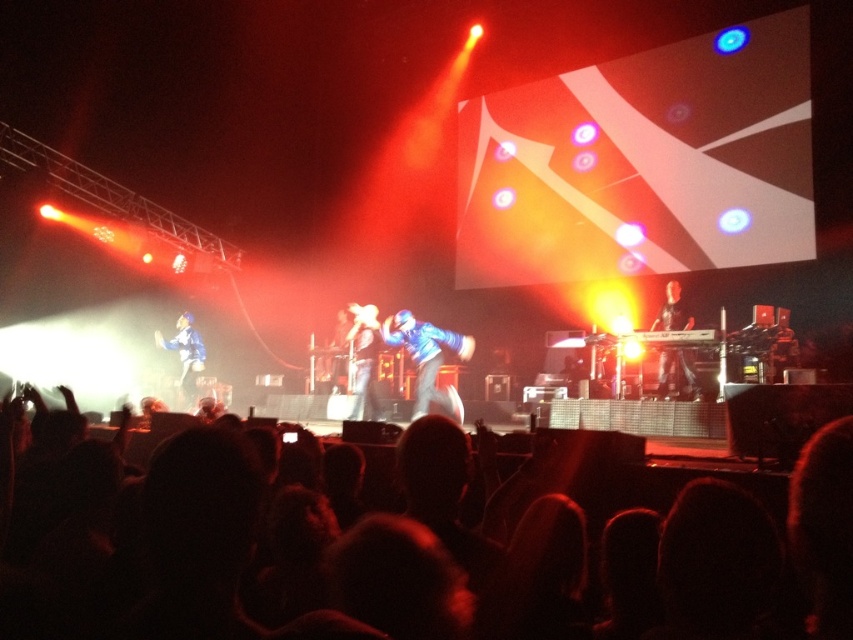
Question: Among these objects, which one is nearest to the camera?

Choices:
 (A) metallic blue suit at center
 (B) black hair at lower center
 (C) blue fabric jacket at left
 (D) shiny black jacket at center

Answer: (B)

Question: Can you confirm if black hair at lower center is smaller than metallic blue suit at center?

Choices:
 (A) yes
 (B) no

Answer: (A)

Question: Can you confirm if shiny black jacket at center is positioned below metallic blue suit at center?

Choices:
 (A) yes
 (B) no

Answer: (A)

Question: Is black hair at lower center to the left of blue denim jeans at center from the viewer's perspective?

Choices:
 (A) yes
 (B) no

Answer: (A)

Question: Based on their relative distances, which object is farther from the metallic blue suit at center?

Choices:
 (A) shiny metallic jacket at center
 (B) shiny black jacket at center
 (C) black hair at lower center
 (D) blue fabric jacket at left

Answer: (C)

Question: Which of the following is the farthest from the observer?

Choices:
 (A) blue fabric jacket at left
 (B) shiny metallic jacket at center
 (C) blue denim jeans at center

Answer: (A)